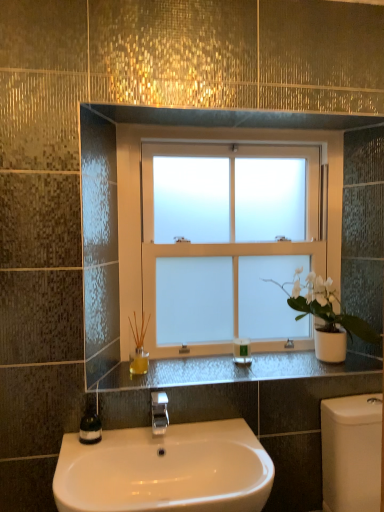
Question: Considering the relative sizes of black granite counter at center and frosted glass window at center in the image provided, is black granite counter at center thinner than frosted glass window at center?

Choices:
 (A) yes
 (B) no

Answer: (B)

Question: From a real-world perspective, is black granite counter at center positioned under frosted glass window at center based on gravity?

Choices:
 (A) yes
 (B) no

Answer: (A)

Question: From the image's perspective, would you say black granite counter at center is positioned over frosted glass window at center?

Choices:
 (A) no
 (B) yes

Answer: (A)

Question: Considering the relative positions of black granite counter at center and frosted glass window at center in the image provided, is black granite counter at center to the right of frosted glass window at center from the viewer's perspective?

Choices:
 (A) no
 (B) yes

Answer: (B)

Question: Is frosted glass window at center surrounded by black granite counter at center?

Choices:
 (A) yes
 (B) no

Answer: (B)

Question: Is black granite counter at center placed right next to frosted glass window at center?

Choices:
 (A) yes
 (B) no

Answer: (B)

Question: From a real-world perspective, is green plastic bottle at center below silver metallic faucet at center?

Choices:
 (A) no
 (B) yes

Answer: (A)

Question: From a real-world perspective, is green plastic bottle at center over silver metallic faucet at center?

Choices:
 (A) no
 (B) yes

Answer: (B)

Question: Is green plastic bottle at center to the right of silver metallic faucet at center from the viewer's perspective?

Choices:
 (A) no
 (B) yes

Answer: (B)

Question: From the image's perspective, would you say green plastic bottle at center is shown under silver metallic faucet at center?

Choices:
 (A) no
 (B) yes

Answer: (A)

Question: Does green plastic bottle at center have a larger size compared to silver metallic faucet at center?

Choices:
 (A) yes
 (B) no

Answer: (B)

Question: Does green plastic bottle at center have a greater width compared to silver metallic faucet at center?

Choices:
 (A) no
 (B) yes

Answer: (A)

Question: Does white glossy sink at lower center appear on the right side of green glass soap dispenser at lower left?

Choices:
 (A) no
 (B) yes

Answer: (B)